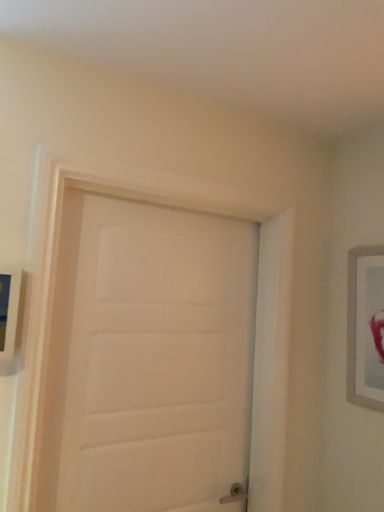
Question: Can you see silver metallic picture frame at right, which appears as the second picture frame when viewed from the left, touching wooden picture frame at left, the 1th picture frame from the front?

Choices:
 (A) no
 (B) yes

Answer: (A)

Question: Considering the relative positions of silver metallic picture frame at right, which is the 1th picture frame from back to front, and wooden picture frame at left, arranged as the 2th picture frame when viewed from the back, in the image provided, is silver metallic picture frame at right, which is the 1th picture frame from back to front, to the right of wooden picture frame at left, arranged as the 2th picture frame when viewed from the back, from the viewer's perspective?

Choices:
 (A) yes
 (B) no

Answer: (A)

Question: Is silver metallic picture frame at right, which appears as the first picture frame when viewed from the right, turned away from wooden picture frame at left, arranged as the 2th picture frame when viewed from the back?

Choices:
 (A) no
 (B) yes

Answer: (A)

Question: From a real-world perspective, is silver metallic picture frame at right, which is the 1th picture frame from back to front, on top of wooden picture frame at left, the 1th picture frame in the left-to-right sequence?

Choices:
 (A) no
 (B) yes

Answer: (A)

Question: From the image's perspective, is silver metallic picture frame at right, which appears as the first picture frame when viewed from the right, over wooden picture frame at left, the 1th picture frame from the front?

Choices:
 (A) no
 (B) yes

Answer: (A)

Question: Is silver metallic picture frame at right, which is the 2th picture frame in front-to-back order, shorter than wooden picture frame at left, the 2th picture frame when ordered from right to left?

Choices:
 (A) yes
 (B) no

Answer: (B)

Question: Does wooden picture frame at left, arranged as the 2th picture frame when viewed from the back, come behind silver metallic picture frame at right, which appears as the second picture frame when viewed from the left?

Choices:
 (A) no
 (B) yes

Answer: (A)

Question: Does wooden picture frame at left, the 1th picture frame from the front, have a greater width compared to silver metallic picture frame at right, which is the 1th picture frame from back to front?

Choices:
 (A) no
 (B) yes

Answer: (B)

Question: Considering the relative positions of wooden picture frame at left, the 2th picture frame when ordered from right to left, and silver metallic picture frame at right, which is the 2th picture frame in front-to-back order, in the image provided, is wooden picture frame at left, the 2th picture frame when ordered from right to left, to the left of silver metallic picture frame at right, which is the 2th picture frame in front-to-back order, from the viewer's perspective?

Choices:
 (A) no
 (B) yes

Answer: (B)

Question: Is wooden picture frame at left, the 2th picture frame when ordered from right to left, far away from silver metallic picture frame at right, which is the 1th picture frame from back to front?

Choices:
 (A) yes
 (B) no

Answer: (A)

Question: From the image's perspective, is wooden picture frame at left, the 1th picture frame from the front, located beneath silver metallic picture frame at right, which appears as the first picture frame when viewed from the right?

Choices:
 (A) yes
 (B) no

Answer: (B)

Question: Is wooden picture frame at left, arranged as the 2th picture frame when viewed from the back, facing towards silver metallic picture frame at right, which is the 1th picture frame from back to front?

Choices:
 (A) no
 (B) yes

Answer: (A)

Question: Can you confirm if silver metallic picture frame at right, which appears as the first picture frame when viewed from the right, is bigger than white matte door at center?

Choices:
 (A) no
 (B) yes

Answer: (A)